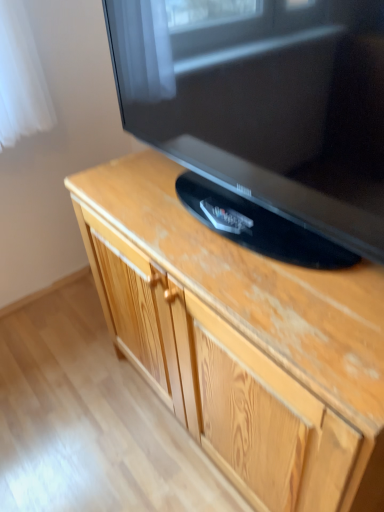
I want to click on free point above wooden cabinet at center (from a real-world perspective), so click(x=230, y=237).